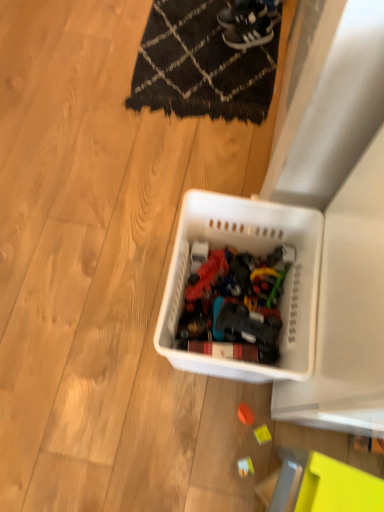
Where is `empty space that is ontop of black woven mat at upper center`? empty space that is ontop of black woven mat at upper center is located at coordinates (209, 44).